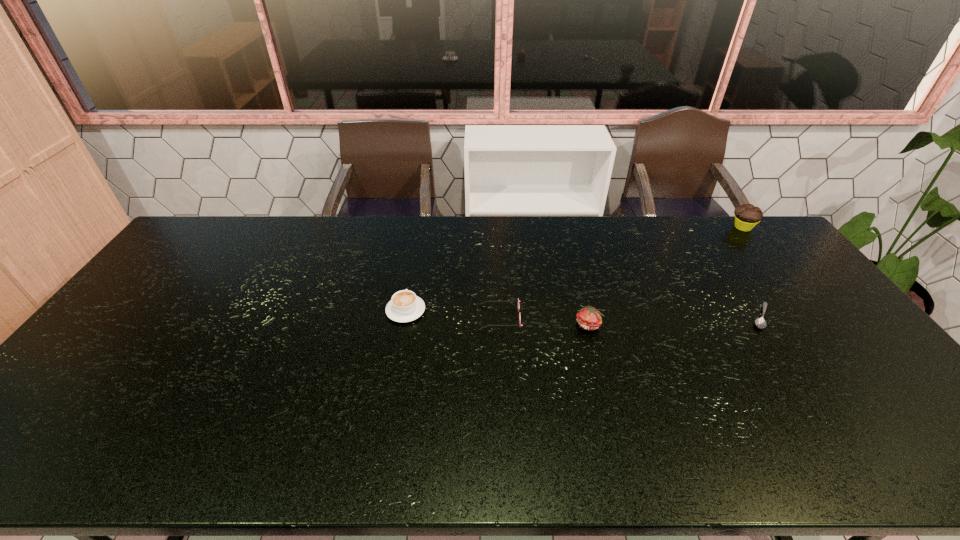
Identify the location of vacant area situated on the left of the farthest object. (652, 227).

Identify the location of vacant region located 0.340m on the front of the third object from left to right. The height and width of the screenshot is (540, 960). (620, 449).

The image size is (960, 540). Identify the location of free space located 0.280m on the side of the cappuccino with the handle. (418, 243).

I want to click on vacant area located 0.380m on the side of the cappuccino with the handle, so (420, 227).

I want to click on free space located on the side of the cappuccino with the handle, so click(417, 248).

The width and height of the screenshot is (960, 540). Find the location of `free space located 0.370m on the bridge of the second shortest object`. free space located 0.370m on the bridge of the second shortest object is located at coordinates pyautogui.click(x=352, y=318).

Find the location of a particular element. The width and height of the screenshot is (960, 540). free space located 0.190m on the bridge of the second shortest object is located at coordinates [414, 318].

This screenshot has width=960, height=540. I want to click on free region located 0.390m on the bridge of the second shortest object, so click(x=346, y=318).

Where is `vacant space located on the right of the soupspoon`? vacant space located on the right of the soupspoon is located at coordinates tap(833, 316).

At what (x,y) coordinates should I click in order to perform the action: click on object that is at the far edge. Please return your answer as a coordinate pair (x, y). Looking at the image, I should click on (747, 216).